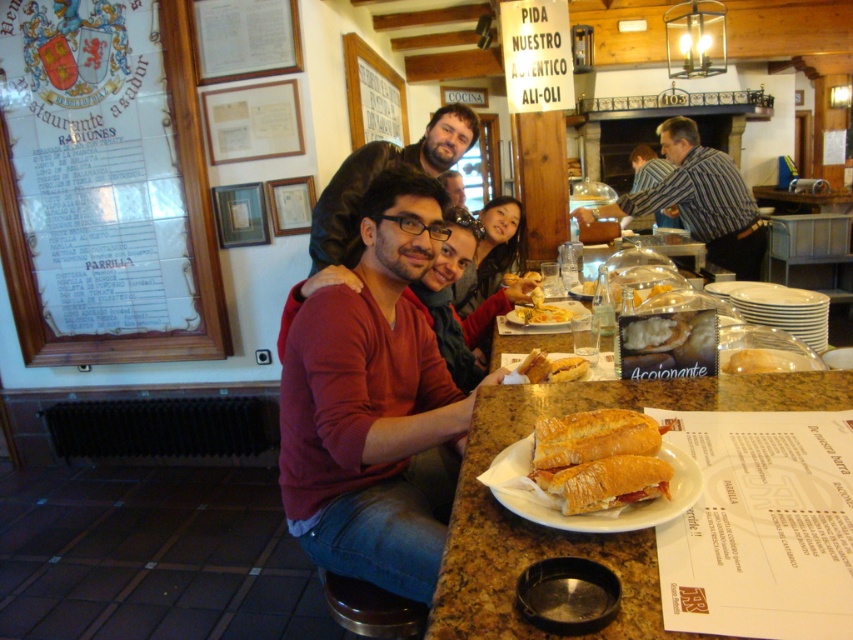
Question: Estimate the real-world distances between objects in this image. Which object is closer to the white paper plate at center?

Choices:
 (A) matte white plate at center
 (B) matte black shirt at center
 (C) striped shirt at upper right

Answer: (A)

Question: Is matte white plate at center further to the viewer compared to slightly toasted bread at center?

Choices:
 (A) yes
 (B) no

Answer: (A)

Question: Does brown bread at center lie in front of slightly toasted bread at center?

Choices:
 (A) yes
 (B) no

Answer: (A)

Question: Which point is closer to the camera?

Choices:
 (A) (721, 369)
 (B) (563, 300)
 (C) (672, 163)

Answer: (A)

Question: Which object is farther from the camera taking this photo?

Choices:
 (A) matte brown leather jacket at center
 (B) white tile menu at left

Answer: (B)

Question: Can you confirm if striped shirt at center is positioned to the right of white paper plate at center?

Choices:
 (A) no
 (B) yes

Answer: (B)